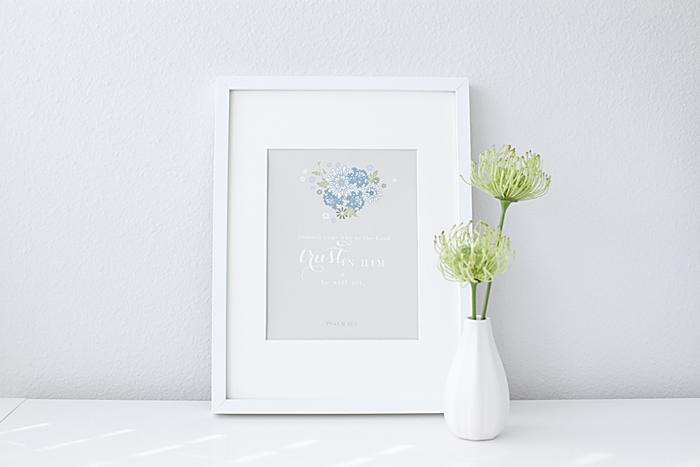
Locate an element on the screen. The width and height of the screenshot is (700, 467). white table is located at coordinates (257, 438).